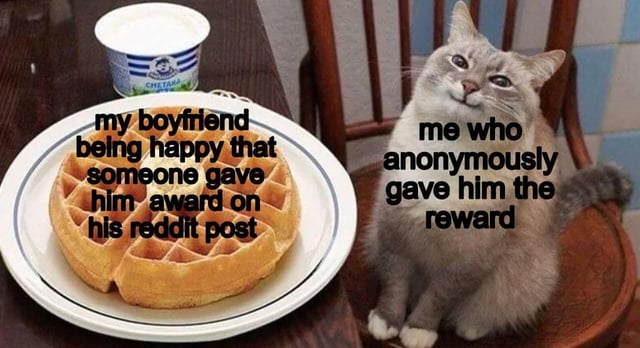
Locate an element on the screen. chair rail is located at coordinates (326, 49).